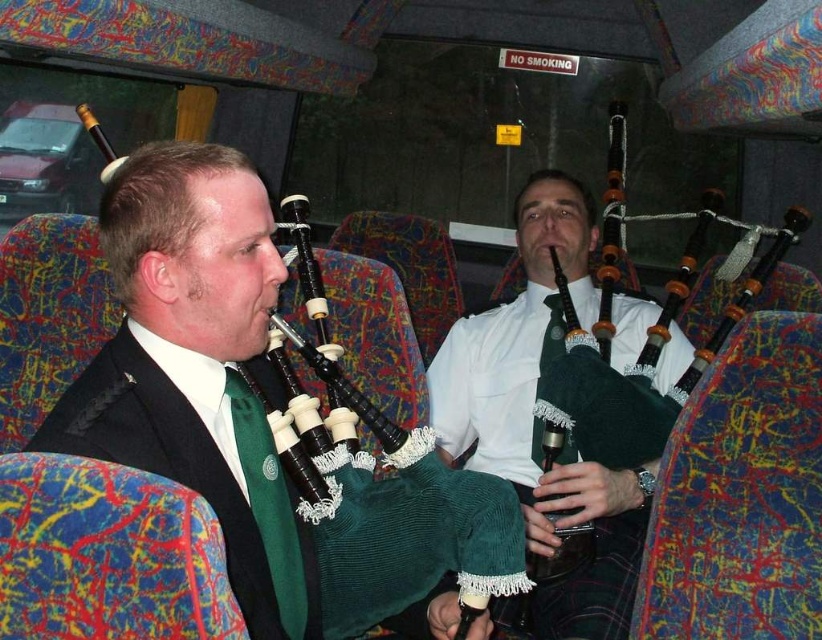
Question: Which of the following is the farthest from the observer?

Choices:
 (A) (208, 264)
 (B) (506, 609)
 (C) (229, 388)

Answer: (B)

Question: Which is farther from the green corduroy kilt at center?

Choices:
 (A) green corduroy tie at center
 (B) matte black bagpipes at center

Answer: (A)

Question: Is green corduroy kilt at center further to camera compared to green corduroy tie at center?

Choices:
 (A) no
 (B) yes

Answer: (B)

Question: Can you confirm if green corduroy kilt at center is positioned to the right of green corduroy tie at center?

Choices:
 (A) no
 (B) yes

Answer: (B)

Question: Where is green corduroy kilt at center located in relation to green corduroy tie at center in the image?

Choices:
 (A) right
 (B) left

Answer: (A)

Question: Which of the following is the farthest from the observer?

Choices:
 (A) (273, 525)
 (B) (268, 477)
 (C) (607, 637)

Answer: (C)